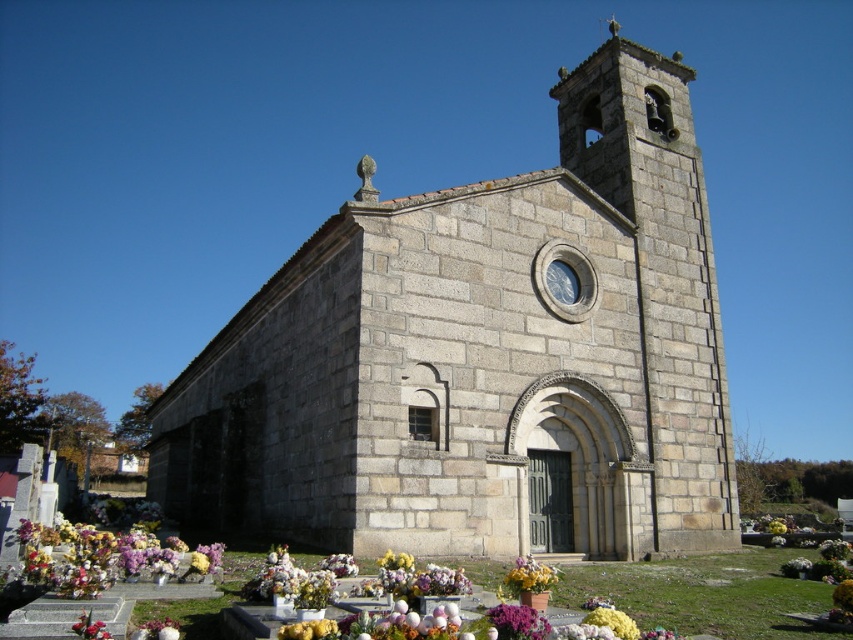
You are standing in front of the church and see the yellow matte flower at lower center and the fluffy silk flower at lower left. Which flower is positioned closer to the main entrance of the church?

The yellow matte flower at lower center is positioned closer to the main entrance of the church because it is to the right of the fluffy silk flower at lower left, and the main entrance is centrally located.

You are standing in front of the stone church and want to take a photo of the point at coordinates point (x=515, y=561). If your camera can focus on objects up to 40 meters away, will it be able to capture the point clearly?

The point (x=515, y=561) is 36.07 meters from the camera, which is within the camera focus range of up to 40 meters. Therefore, the camera can capture the point clearly.